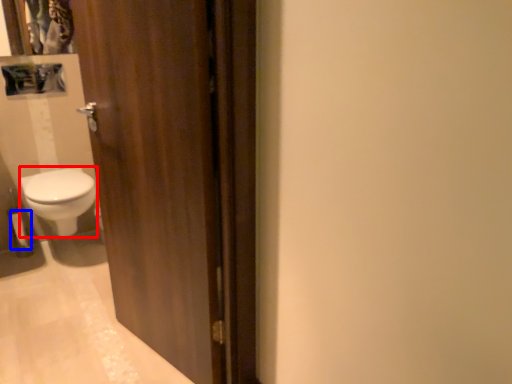
Question: Which object appears closest to the camera in this image, bidet (highlighted by a red box) or toilet paper (highlighted by a blue box)?

Choices:
 (A) bidet
 (B) toilet paper

Answer: (A)